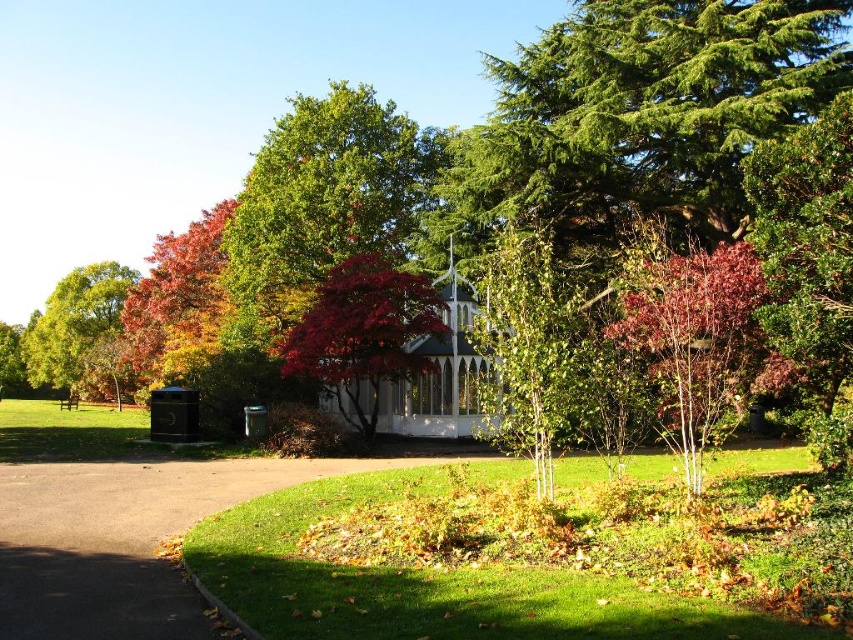
Question: Where is purple-barked tree at center-right located in relation to green smooth tree at center in the image?

Choices:
 (A) below
 (B) above

Answer: (B)

Question: Which object appears farthest from the camera in this image?

Choices:
 (A) green smooth tree at center
 (B) green leafy tree at left
 (C) shiny red leaves at left

Answer: (B)

Question: Is green glossy bush at upper right closer to the viewer compared to green smooth tree at center?

Choices:
 (A) no
 (B) yes

Answer: (B)

Question: Is green glossy bush at upper right thinner than white wood gazebo at center?

Choices:
 (A) no
 (B) yes

Answer: (A)

Question: Estimate the real-world distances between objects in this image. Which object is closer to the green glossy bush at upper right?

Choices:
 (A) shiny red leaves at left
 (B) green smooth tree at center
 (C) white wood gazebo at center

Answer: (B)

Question: Among these objects, which one is farthest from the camera?

Choices:
 (A) shiny red maple tree at center
 (B) green glossy bush at upper right

Answer: (A)